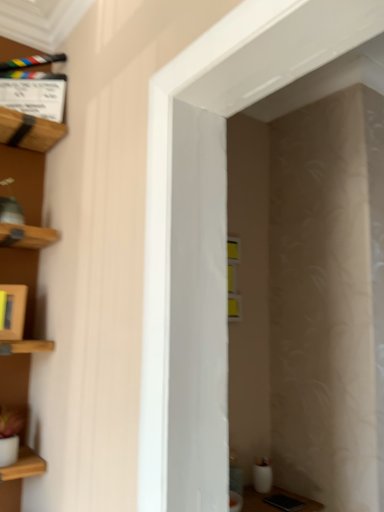
Question: Does wooden clapperboard at upper left have a greater height compared to wooden frame at left?

Choices:
 (A) no
 (B) yes

Answer: (B)

Question: Considering the relative sizes of wooden clapperboard at upper left and wooden frame at left in the image provided, is wooden clapperboard at upper left shorter than wooden frame at left?

Choices:
 (A) no
 (B) yes

Answer: (A)

Question: From a real-world perspective, is wooden clapperboard at upper left located beneath wooden frame at left?

Choices:
 (A) no
 (B) yes

Answer: (A)

Question: Does wooden clapperboard at upper left have a larger size compared to wooden frame at left?

Choices:
 (A) yes
 (B) no

Answer: (A)

Question: From the image's perspective, does wooden clapperboard at upper left appear lower than wooden frame at left?

Choices:
 (A) no
 (B) yes

Answer: (A)

Question: Is wooden clapperboard at upper left at the right side of wooden frame at left?

Choices:
 (A) yes
 (B) no

Answer: (A)

Question: Is wooden frame at left turned away from wooden clapperboard at upper left?

Choices:
 (A) no
 (B) yes

Answer: (A)

Question: Is wooden frame at left oriented towards wooden clapperboard at upper left?

Choices:
 (A) yes
 (B) no

Answer: (B)

Question: Is wooden clapperboard at upper left a part of wooden frame at left?

Choices:
 (A) yes
 (B) no

Answer: (B)

Question: From a real-world perspective, does wooden frame at left stand above wooden clapperboard at upper left?

Choices:
 (A) yes
 (B) no

Answer: (B)

Question: Is wooden frame at left completely or partially outside of wooden clapperboard at upper left?

Choices:
 (A) yes
 (B) no

Answer: (A)

Question: Is wooden frame at left next to wooden clapperboard at upper left?

Choices:
 (A) no
 (B) yes

Answer: (A)

Question: Does wooden frame at left touch white glossy door at center?

Choices:
 (A) yes
 (B) no

Answer: (B)